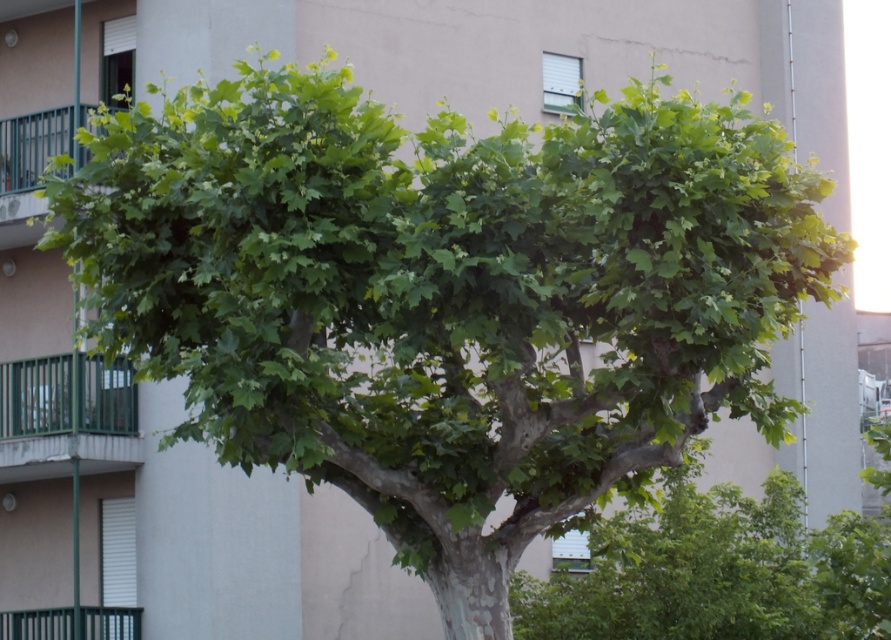
Measure the distance between green metal railing at lower left and green metal railing at upper left.

6.27 feet

Is green metal railing at lower left above green metal railing at upper left?

Incorrect, green metal railing at lower left is not positioned above green metal railing at upper left.

Where is `green metal railing at lower left`? green metal railing at lower left is located at coordinates (66, 417).